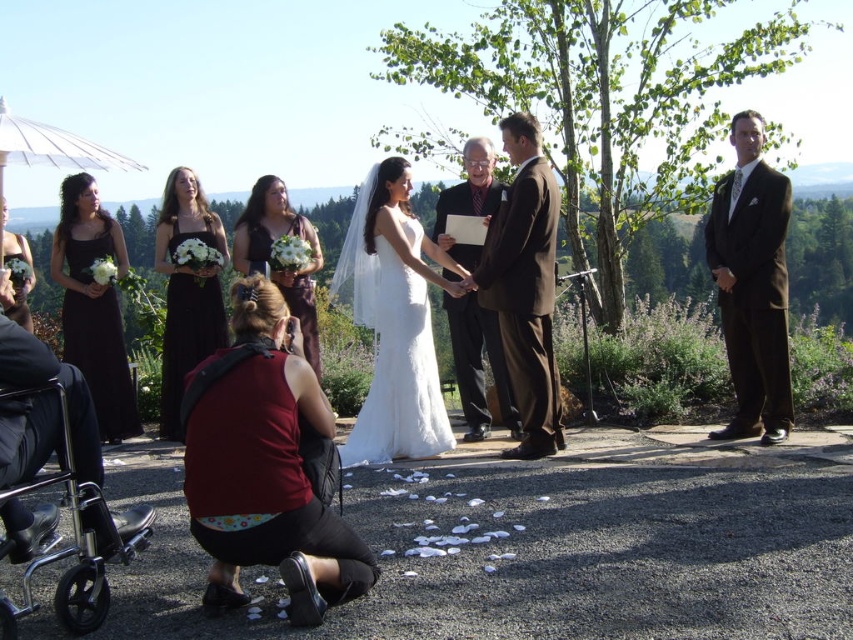
Between red fabric camera at lower center and white satin dress at center, which one has more height?

white satin dress at center is taller.

This screenshot has width=853, height=640. Find the location of `red fabric camera at lower center`. red fabric camera at lower center is located at coordinates (265, 465).

Who is more distant from viewer, (288, 333) or (364, 228)?

Point (364, 228)

Find the location of a particular element. This screenshot has width=853, height=640. red fabric camera at lower center is located at coordinates (265, 465).

Can you confirm if red fabric camera at lower center is positioned below brown suit at right?

Correct, red fabric camera at lower center is located below brown suit at right.

Can you confirm if red fabric camera at lower center is wider than brown suit at right?

Indeed, red fabric camera at lower center has a greater width compared to brown suit at right.

Who is more forward, (221, 401) or (775, 173)?

Point (221, 401) is more forward.

You are a GUI agent. You are given a task and a screenshot of the screen. Output one action in this format:
    pyautogui.click(x=<x>, y=<y>)
    Task: Click on the red fabric camera at lower center
    This screenshot has width=853, height=640.
    Given the screenshot: What is the action you would take?
    pos(265,465)

Is brown suit at center closer to the viewer compared to black satin dress at left?

Yes, brown suit at center is in front of black satin dress at left.

Between brown suit at center and black satin dress at left, which one is positioned higher?

brown suit at center is higher up.

Is point (495, 307) positioned behind point (74, 214)?

No, it is not.

This screenshot has width=853, height=640. I want to click on brown suit at center, so click(525, 285).